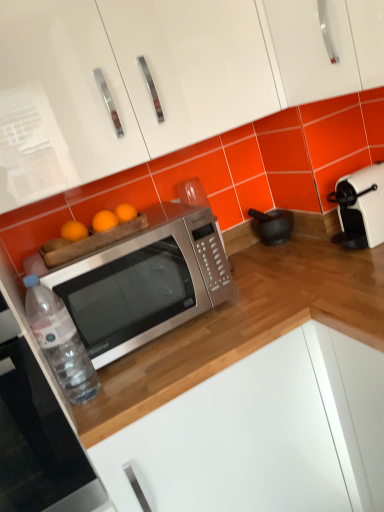
Find the location of a particular element. The height and width of the screenshot is (512, 384). free space between clear plastic bottle at lower left and satin silver microwave at center is located at coordinates (149, 352).